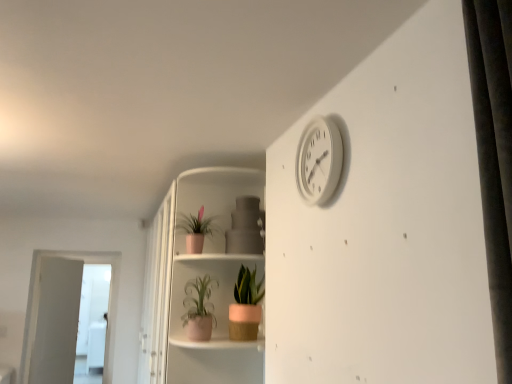
Question: Is white glossy screen door at left, which appears as the 2th screen door when viewed from the left, not close to white plastic clock at upper right?

Choices:
 (A) yes
 (B) no

Answer: (A)

Question: Considering the relative sizes of white glossy screen door at left, placed as the 1th screen door when sorted from front to back, and white plastic clock at upper right in the image provided, is white glossy screen door at left, placed as the 1th screen door when sorted from front to back, taller than white plastic clock at upper right?

Choices:
 (A) no
 (B) yes

Answer: (B)

Question: Is white plastic clock at upper right at the back of white glossy screen door at left, the second screen door when ordered from back to front?

Choices:
 (A) no
 (B) yes

Answer: (A)

Question: Could you tell me if white glossy screen door at left, which appears as the 2th screen door when viewed from the left, is facing white plastic clock at upper right?

Choices:
 (A) yes
 (B) no

Answer: (A)

Question: Considering the relative sizes of white glossy screen door at left, which appears as the 2th screen door when viewed from the left, and white plastic clock at upper right in the image provided, is white glossy screen door at left, which appears as the 2th screen door when viewed from the left, wider than white plastic clock at upper right?

Choices:
 (A) no
 (B) yes

Answer: (B)

Question: Looking at the image, does white glossy screen door at left, placed as the 1th screen door when sorted from front to back, seem bigger or smaller compared to pink matte pot at upper center, acting as the 1th houseplant starting from the left?

Choices:
 (A) big
 (B) small

Answer: (A)

Question: From a real-world perspective, is white glossy screen door at left, the second screen door when ordered from back to front, physically located above or below pink matte pot at upper center, which is the 3th houseplant in right-to-left order?

Choices:
 (A) above
 (B) below

Answer: (B)

Question: In terms of height, does white glossy screen door at left, the second screen door when ordered from back to front, look taller or shorter compared to pink matte pot at upper center, which is the 3th houseplant in right-to-left order?

Choices:
 (A) short
 (B) tall

Answer: (B)

Question: From the image's perspective, is white glossy screen door at left, which appears as the 2th screen door when viewed from the left, located above or below pink matte pot at upper center, which is the 3th houseplant in right-to-left order?

Choices:
 (A) above
 (B) below

Answer: (B)

Question: From the image's perspective, relative to white glossy screen door at left, the second screen door when ordered from back to front, is pink matte pot at upper center, acting as the 1th houseplant starting from the left, above or below?

Choices:
 (A) below
 (B) above

Answer: (B)

Question: Is point (192, 246) closer or farther from the camera than point (31, 271)?

Choices:
 (A) closer
 (B) farther

Answer: (A)

Question: Choose the correct answer: Is pink matte pot at upper center, acting as the 1th houseplant starting from the left, inside white glossy screen door at left, which appears as the 2th screen door when viewed from the left, or outside it?

Choices:
 (A) outside
 (B) inside

Answer: (A)

Question: From a real-world perspective, relative to white glossy screen door at left, placed as the 1th screen door when sorted from front to back, is pink matte pot at upper center, acting as the 1th houseplant starting from the left, vertically above or below?

Choices:
 (A) below
 (B) above

Answer: (B)

Question: From the image's perspective, relative to white glossy screen door at lower left, the second screen door positioned from the front, is pink matte pot at lower center, placed as the third houseplant when sorted from left to right, above or below?

Choices:
 (A) below
 (B) above

Answer: (B)

Question: Looking at their shapes, would you say pink matte pot at lower center, placed as the third houseplant when sorted from left to right, is wider or thinner than white glossy screen door at lower left, positioned as the first screen door in back-to-front order?

Choices:
 (A) wide
 (B) thin

Answer: (A)